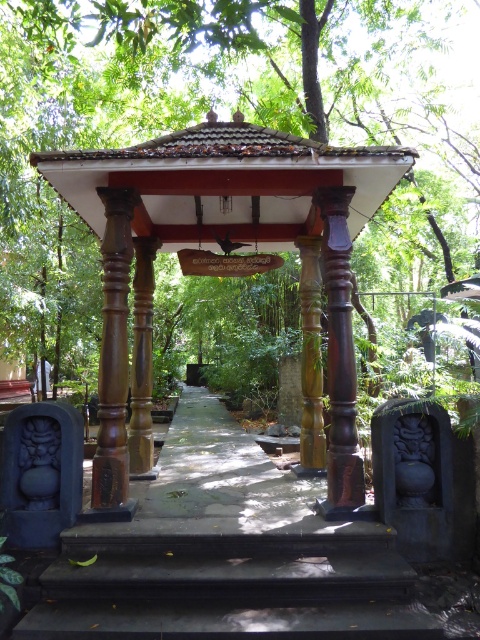
Question: Does brown polished wood gazebo at center appear over black stone stairs at center?

Choices:
 (A) yes
 (B) no

Answer: (A)

Question: Is brown polished wood gazebo at center thinner than black stone stairs at center?

Choices:
 (A) no
 (B) yes

Answer: (A)

Question: Among these points, which one is nearest to the camera?

Choices:
 (A) (123, 273)
 (B) (170, 544)

Answer: (B)

Question: Can you confirm if brown polished wood gazebo at center is positioned to the right of black stone stairs at center?

Choices:
 (A) no
 (B) yes

Answer: (A)

Question: Which of the following is the farthest from the observer?

Choices:
 (A) brown polished wood gazebo at center
 (B) black stone stairs at center

Answer: (A)